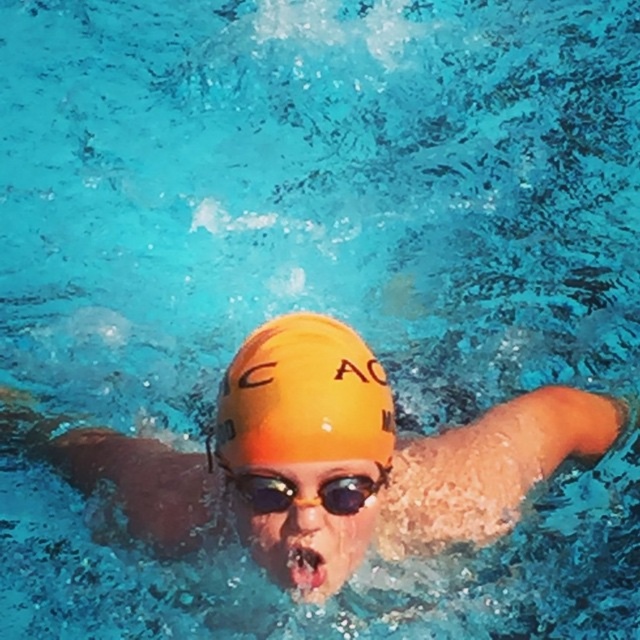
You are a lifeguard observing the swimmer in the pool. You notice the yellow matte swim cap at center and the transparent yellow goggles at center. Which object is bigger in size?

The yellow matte swim cap at center has a larger size compared to the transparent yellow goggles at center.

You are a lifeguard observing the pool from above. There is a point at coordinates (328, 460). What object is located at that point?

The orange matte swim cap at center is located at point (328, 460).

From the picture: You are standing at the edge of the pool and want to hand the swimmer a towel. The swimmer is wearing the orange matte swim cap at center. Can you reach them with a 1.2 meter long pool pole?

The orange matte swim cap at center is 1.35 meters away from the viewer. The pool pole is only 1.2 meters long, so you cannot reach the swimmer with it.